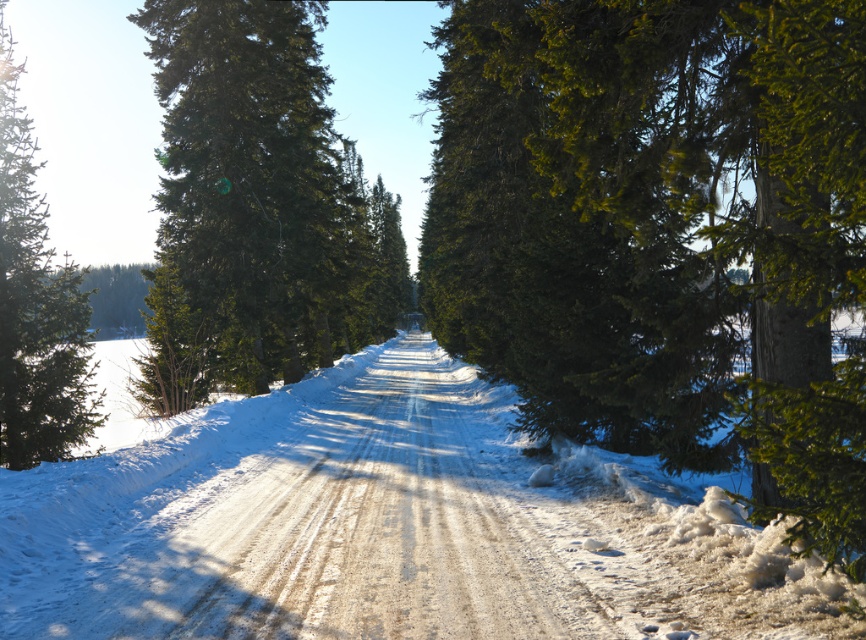
Question: Is the position of green textured pine tree at center less distant than that of green matte tree at center?

Choices:
 (A) no
 (B) yes

Answer: (B)

Question: Among these objects, which one is farthest from the camera?

Choices:
 (A) green textured pine tree at center
 (B) green matte evergreen tree at left

Answer: (B)

Question: Does green textured pine tree at center have a larger size compared to green matte tree at center?

Choices:
 (A) no
 (B) yes

Answer: (A)

Question: Which point is closer to the camera taking this photo?

Choices:
 (A) (469, 528)
 (B) (0, 100)
 (C) (270, 372)
 (D) (795, 422)

Answer: (D)

Question: Which point appears farthest from the camera in this image?

Choices:
 (A) (779, 195)
 (B) (263, 227)
 (C) (401, 541)

Answer: (B)

Question: Is green textured pine tree at center behind white sandy dirt track at center?

Choices:
 (A) no
 (B) yes

Answer: (A)